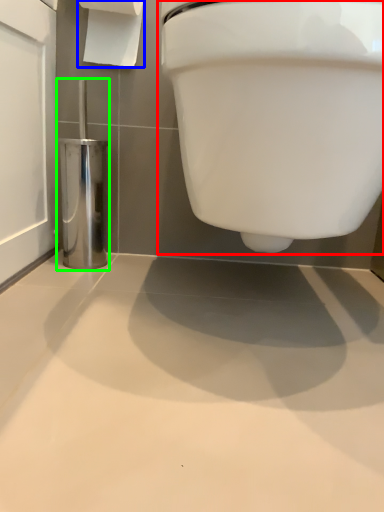
Question: Which object is the farthest from toilet (highlighted by a red box)? Choose among these: toilet paper (highlighted by a blue box) or porcelain (highlighted by a green box).

Choices:
 (A) toilet paper
 (B) porcelain

Answer: (A)